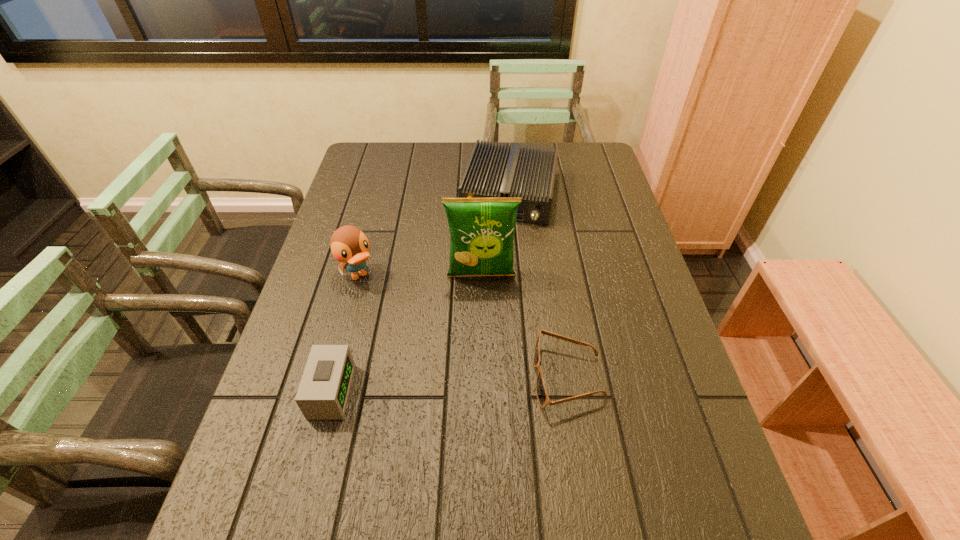
Locate an element on the screen. The height and width of the screenshot is (540, 960). alarm clock that is at the left edge is located at coordinates (323, 393).

What are the coordinates of `duck that is at the left edge` in the screenshot? It's located at (349, 245).

In the image, there is a desktop. Where is `vacant space at the far edge`? This screenshot has height=540, width=960. vacant space at the far edge is located at coordinates (436, 147).

In the image, there is a desktop. At what (x,y) coordinates should I click in order to perform the action: click on vacant space at the near edge. Please return your answer as a coordinate pair (x, y). The width and height of the screenshot is (960, 540). Looking at the image, I should click on (548, 447).

Locate an element on the screen. This screenshot has width=960, height=540. free space at the left edge of the desktop is located at coordinates (334, 283).

The width and height of the screenshot is (960, 540). I want to click on vacant position at the right edge of the desktop, so click(x=585, y=193).

In the image, there is a desktop. At what (x,y) coordinates should I click in order to perform the action: click on vacant area at the far right corner. Please return your answer as a coordinate pair (x, y). This screenshot has height=540, width=960. Looking at the image, I should click on (571, 154).

You are a GUI agent. You are given a task and a screenshot of the screen. Output one action in this format:
    pyautogui.click(x=<x>, y=<y>)
    Task: Click on the blank space at the near right corner of the desktop
    
    Given the screenshot: What is the action you would take?
    pyautogui.click(x=710, y=484)

Find the location of `vacant area that lies between the sunglasses and the fourth tallest object`. vacant area that lies between the sunglasses and the fourth tallest object is located at coordinates (449, 384).

Identify the location of unoccupied area between the sunglasses and the crisp (potato chip). This screenshot has width=960, height=540. (525, 327).